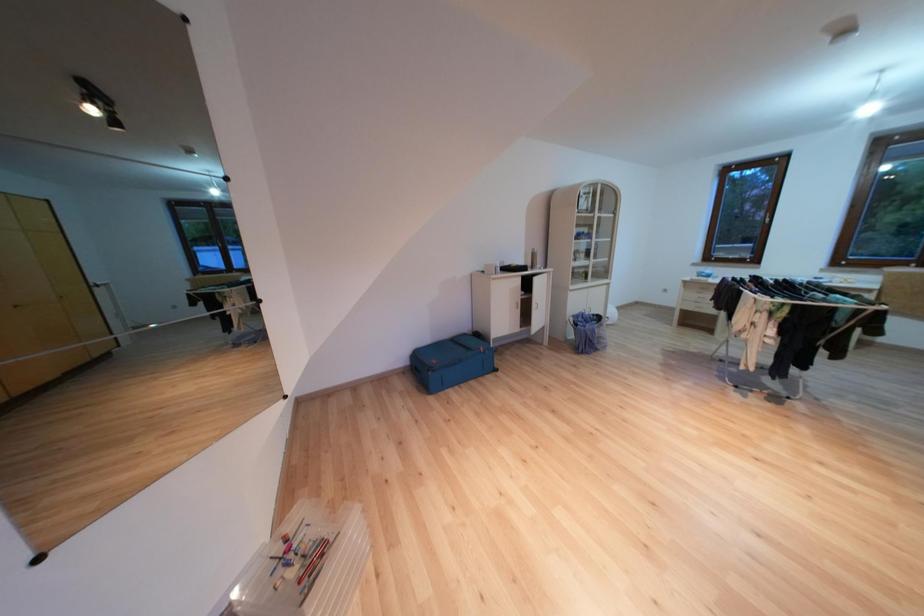
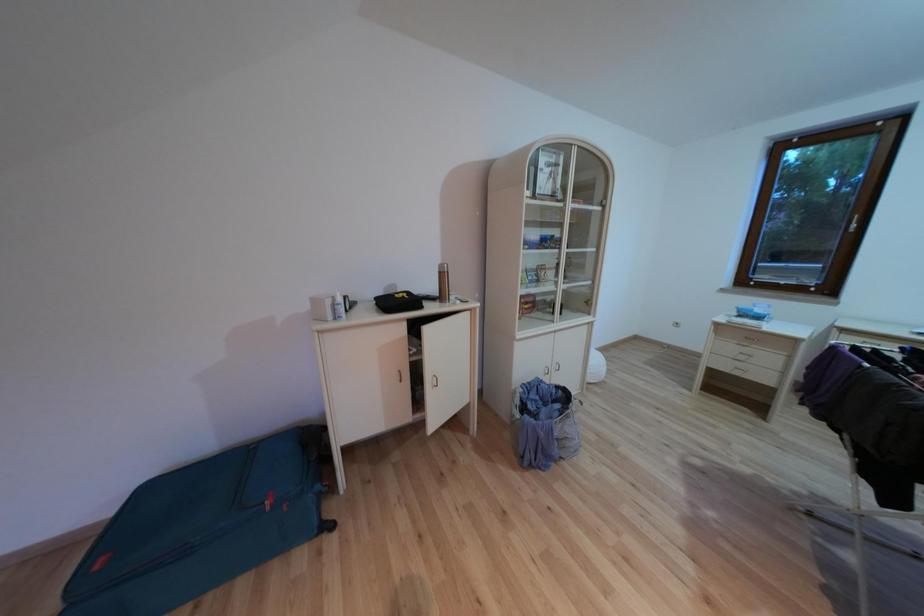
In a continuous first-person perspective shot, in which direction is the camera moving?

The movement direction of the cameraman is right, forward.